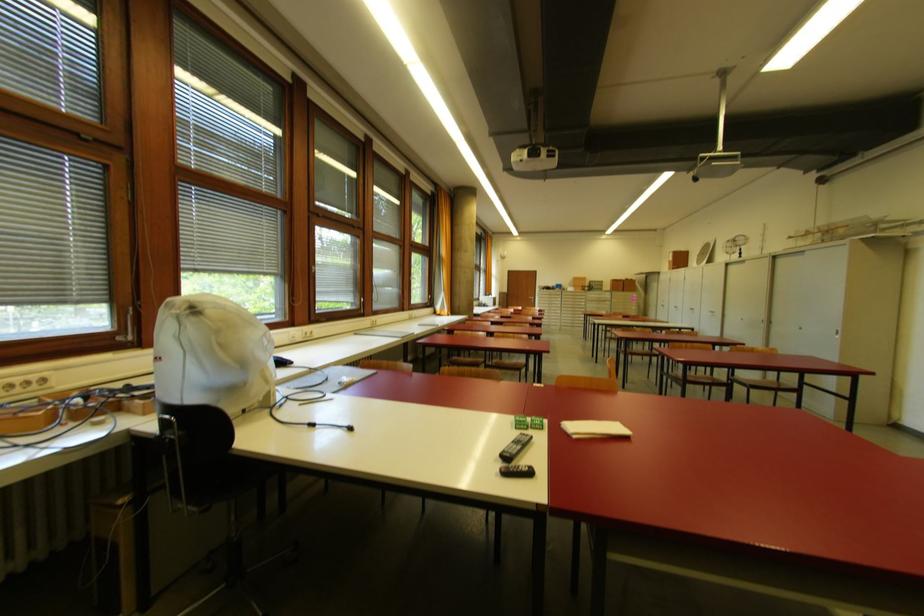
Find where to turn the door handle. Please return your answer as a coordinate pair (x, y).

(915, 346)